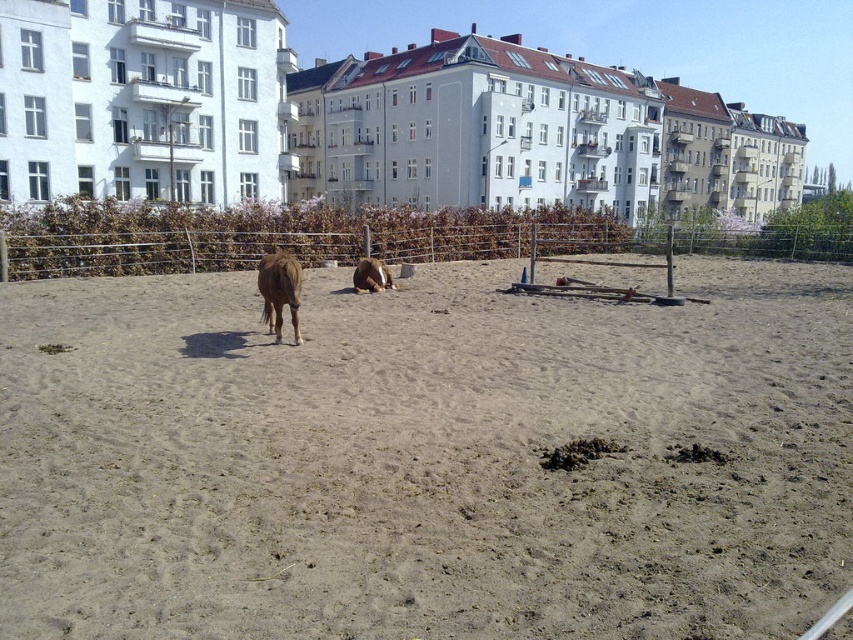
You are a farmer checking on your horses in the sandy enclosure. You notice two horses at the center. Which horse is positioned lower in the image, the brown fuzzy horse at center or the brown furry horse at center?

The brown fuzzy horse at center is located below the brown furry horse at center, so it is positioned lower in the image.

You are a farmer who needs to separate the two horses into two different stalls. The stalls are 15 feet apart from each other. Based on the image, can you determine if the distance between the brown fuzzy horse at center and the brown furry horse at center is sufficient to move them to the stalls without needing to adjust their current positions?

The brown fuzzy horse at center is 14.88 feet from the brown furry horse at center. Since the stalls are 15 feet apart, the current distance between the horses is slightly less than required. Therefore, you would need to adjust their positions to ensure they are at least 15 feet apart for the stalls.